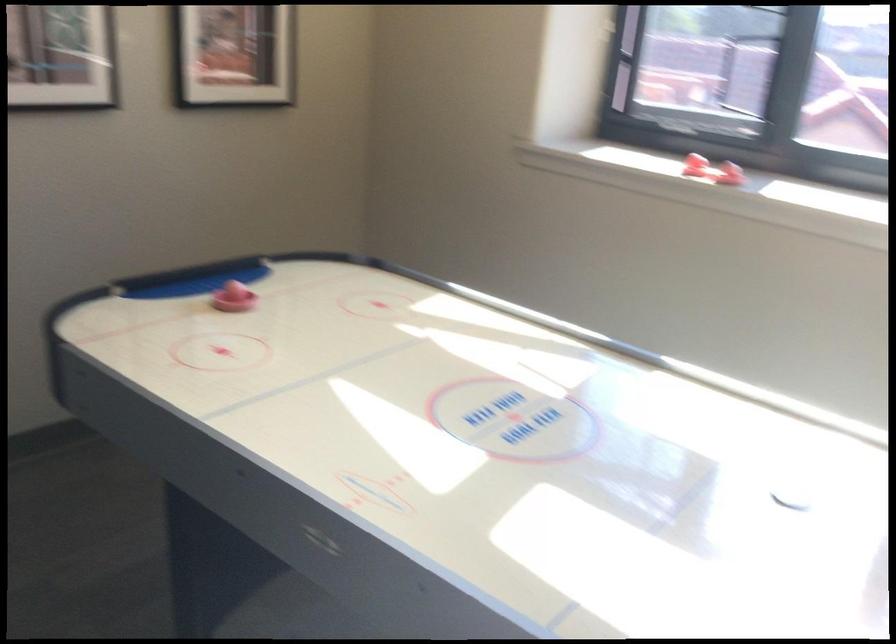
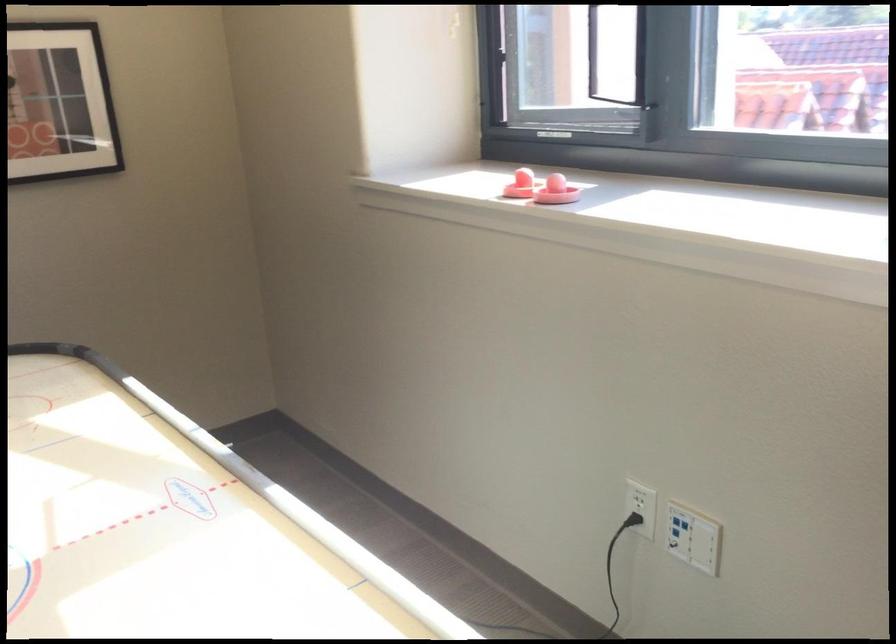
The point at (750, 115) is marked in the first image. Where is the corresponding point in the second image?

(638, 102)